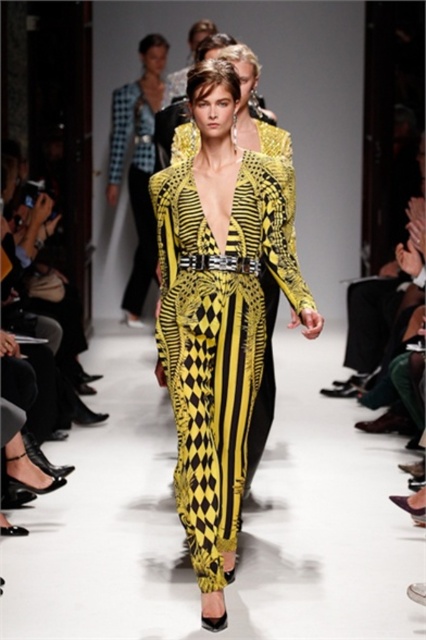
You are a photographer at the runway show. You need to capture a photo of both the yellow printed dress at center and the yellow printed jumpsuit at center in the same frame. Your camera has a maximum focus range of 6 meters. Will you be able to capture both items in focus?

The distance between the yellow printed dress at center and the yellow printed jumpsuit at center is 6.04 meters. Since the camera can only focus up to 6 meters, the items are slightly out of range, so you might not be able to capture both in focus.

Based on the runway scene described, which clothing item is positioned lower on the model, the yellow printed dress at center or the yellow printed jumpsuit at center?

The yellow printed dress at center is positioned lower than the yellow printed jumpsuit at center.

You are a fashion designer observing the runway show. You notice two garments at the center of the image. Which one is shorter in height between the yellow printed dress at center and the yellow printed jumpsuit at center?

The yellow printed dress at center is shorter in height than the yellow printed jumpsuit at center.